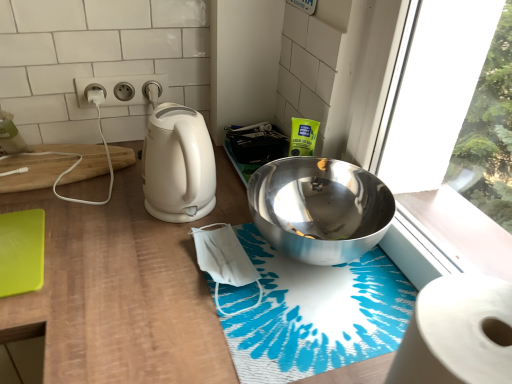
Locate an element on the screen. The width and height of the screenshot is (512, 384). free spot to the left of blue printed bath mat at center is located at coordinates (140, 292).